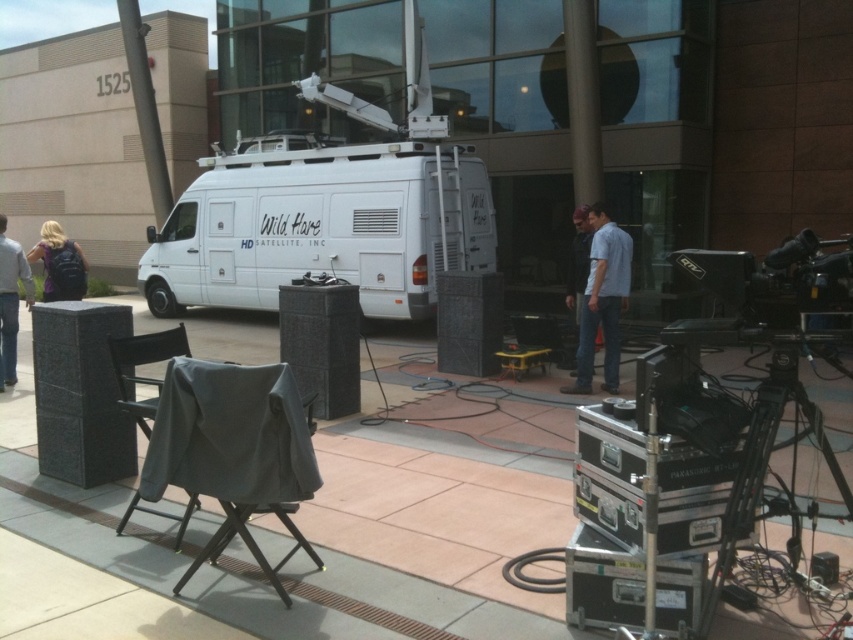
Question: Can you confirm if blue denim jeans at center is wider than blue jeans at center?

Choices:
 (A) yes
 (B) no

Answer: (A)

Question: Which object is closer to the camera taking this photo?

Choices:
 (A) gray fabric chair at lower left
 (B) blue denim jeans at center
 (C) purple matte backpack at left
 (D) white matte van at center

Answer: (A)

Question: Considering the real-world distances, which object is farthest from the denim jacket at left?

Choices:
 (A) white matte van at center
 (B) purple matte backpack at left

Answer: (A)

Question: Which object is positioned closest to the denim jacket at left?

Choices:
 (A) purple matte backpack at left
 (B) blue jeans at center
 (C) white matte van at center

Answer: (A)

Question: Is blue denim jeans at center smaller than gray fabric chair at lower left?

Choices:
 (A) yes
 (B) no

Answer: (B)

Question: Does blue denim jeans at center appear on the right side of blue jeans at center?

Choices:
 (A) yes
 (B) no

Answer: (B)